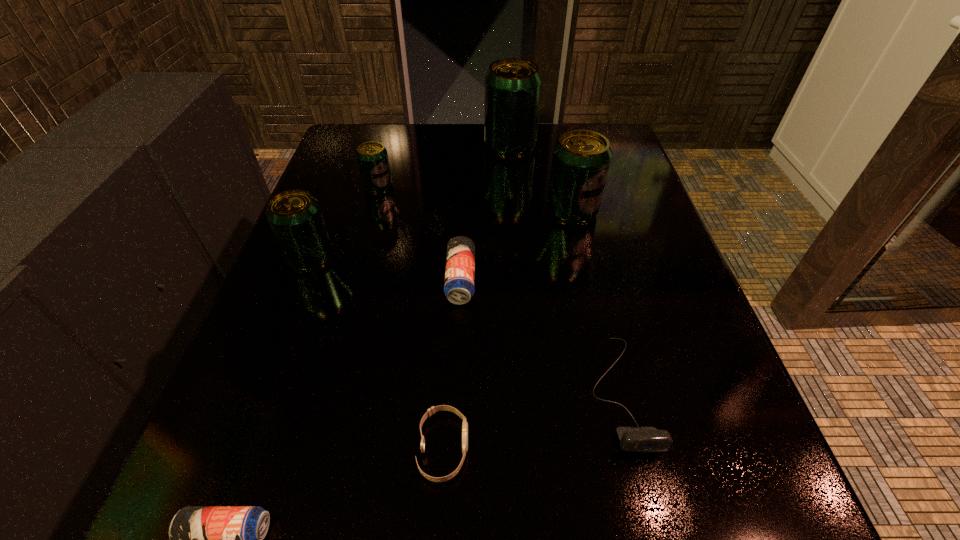
You are a GUI agent. You are given a task and a screenshot of the screen. Output one action in this format:
    pyautogui.click(x=<x>, y=<y>)
    Task: Click on the tallest beer can
    
    Given the screenshot: What is the action you would take?
    pyautogui.click(x=513, y=86)

Locate an element on the screen. the biggest green beer can is located at coordinates (513, 86).

In order to click on the second biggest green beer can in this screenshot , I will do `click(581, 158)`.

Identify the location of the third farthest green beer can. (581, 158).

What are the coordinates of `the nearest green beer can` in the screenshot? It's located at (295, 218).

Where is `the sixth shortest object`? The width and height of the screenshot is (960, 540). the sixth shortest object is located at coordinates (295, 218).

Where is `the fifth shortest object`? This screenshot has width=960, height=540. the fifth shortest object is located at coordinates (372, 157).

You are a GUI agent. You are given a task and a screenshot of the screen. Output one action in this format:
    pyautogui.click(x=<x>, y=<y>)
    Task: Click on the fourth tallest beer can
    This screenshot has height=540, width=960.
    Given the screenshot: What is the action you would take?
    pyautogui.click(x=372, y=157)

I want to click on the fourth beer can from left to right, so pos(459,286).

Find the location of a particular element. the right blue beer can is located at coordinates (459, 286).